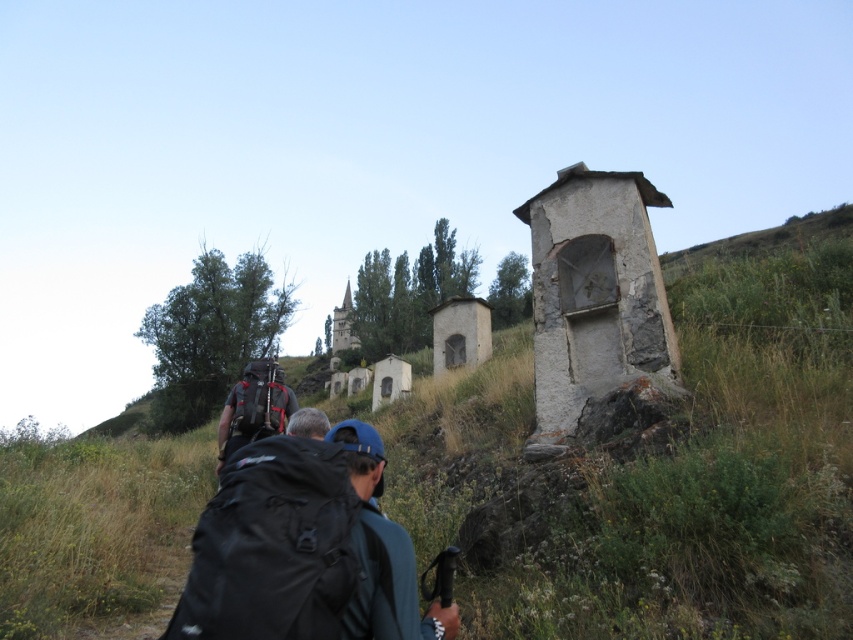
Which of these two, white stone chapel at center or smooth stone chapel at center, stands shorter?

white stone chapel at center

Which is above, white stone chapel at center or smooth stone chapel at center?

smooth stone chapel at center is above.

You are a GUI agent. You are given a task and a screenshot of the screen. Output one action in this format:
    pyautogui.click(x=<x>, y=<y>)
    Task: Click on the white stone chapel at center
    The height and width of the screenshot is (640, 853).
    Given the screenshot: What is the action you would take?
    pyautogui.click(x=596, y=308)